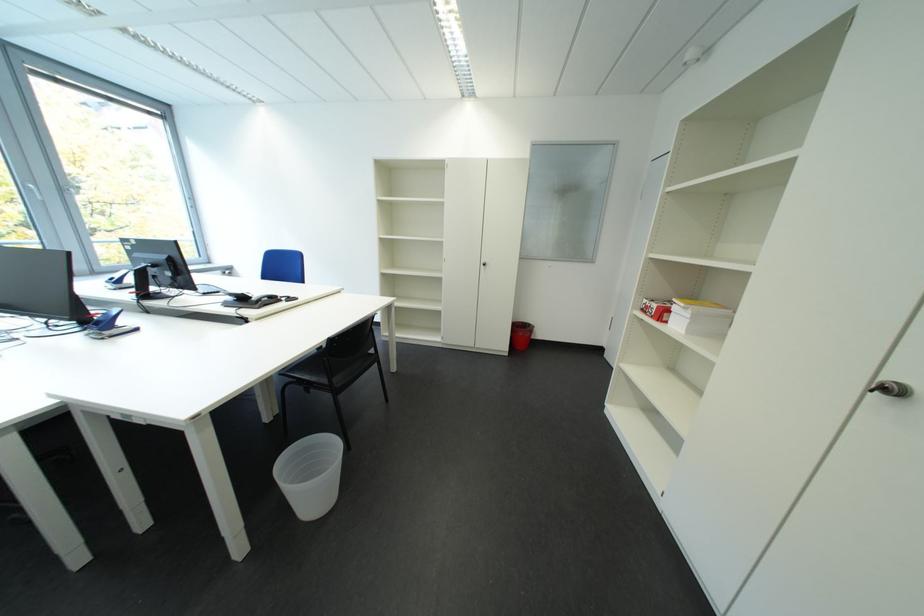
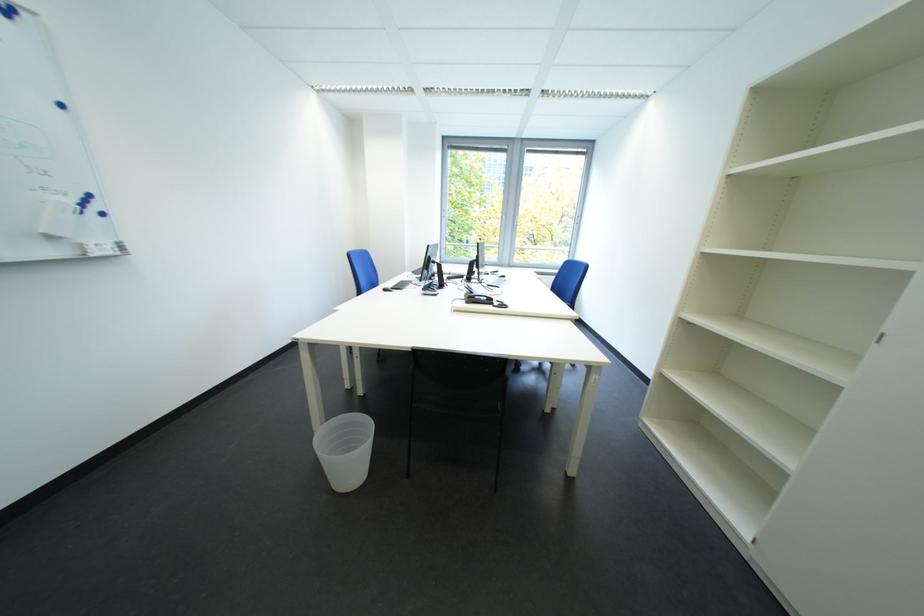
Question: I am providing you with two images of the same scene from different viewpoints. Which of the following objects are not visible in image2?

Choices:
 (A) translucent trash can
 (B) blue magnet
 (C) computer keyboard
 (D) none of these

Answer: (D)